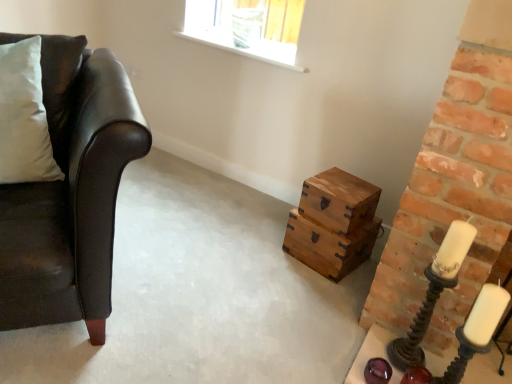
Locate an element on the screen. vacant space to the right of matte black leather couch at left is located at coordinates (224, 286).